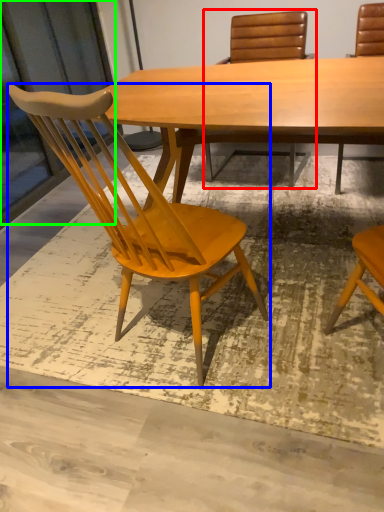
Question: Which is nearer to the chair (highlighted by a red box)? chair (highlighted by a blue box) or screen door (highlighted by a green box).

Choices:
 (A) chair
 (B) screen door

Answer: (B)